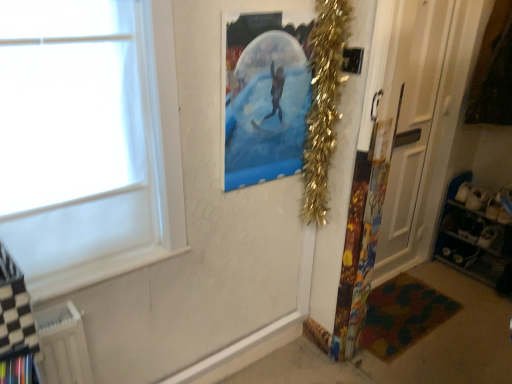
Question: Is metallic blue shelves at lower right outside white glossy door at right?

Choices:
 (A) yes
 (B) no

Answer: (A)

Question: Is metallic blue shelves at lower right further to camera compared to white glossy door at right?

Choices:
 (A) no
 (B) yes

Answer: (B)

Question: From the image's perspective, is metallic blue shelves at lower right over white glossy door at right?

Choices:
 (A) no
 (B) yes

Answer: (A)

Question: Is metallic blue shelves at lower right thinner than white glossy door at right?

Choices:
 (A) no
 (B) yes

Answer: (A)

Question: Is metallic blue shelves at lower right to the right of white glossy door at right from the viewer's perspective?

Choices:
 (A) no
 (B) yes

Answer: (B)

Question: Is metallic blue shelves at lower right taller than white glossy door at right?

Choices:
 (A) yes
 (B) no

Answer: (B)

Question: From a real-world perspective, is white glossy door at right under white plastic radiator at lower left?

Choices:
 (A) no
 (B) yes

Answer: (A)

Question: Does white glossy door at right appear on the left side of white plastic radiator at lower left?

Choices:
 (A) yes
 (B) no

Answer: (B)

Question: Is white glossy door at right wider than white plastic radiator at lower left?

Choices:
 (A) yes
 (B) no

Answer: (B)

Question: Could you tell me if white glossy door at right is facing white plastic radiator at lower left?

Choices:
 (A) no
 (B) yes

Answer: (A)

Question: Can we say white glossy door at right lies outside white plastic radiator at lower left?

Choices:
 (A) yes
 (B) no

Answer: (A)

Question: Does white glossy door at right have a greater height compared to white plastic radiator at lower left?

Choices:
 (A) yes
 (B) no

Answer: (A)

Question: Does multicolored fabric mat at lower right come in front of white plastic radiator at lower left?

Choices:
 (A) yes
 (B) no

Answer: (B)